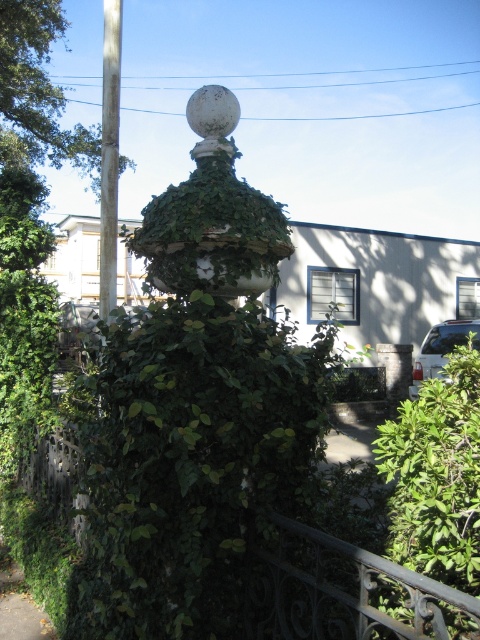
You are standing at the base of the column in the scene. You want to walk from the green leafy bush at lower right to the brown wood tree at upper left. How far will you have to walk?

The distance between the green leafy bush at lower right and the brown wood tree at upper left is 15.64 meters, so you will have to walk 15.64 meters to reach the brown wood tree at upper left from the green leafy bush at lower right.